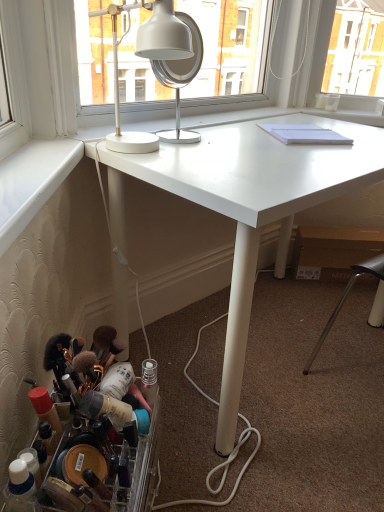
Locate an element on the screen. vacant region in front of white glossy desk lamp at upper center is located at coordinates (168, 168).